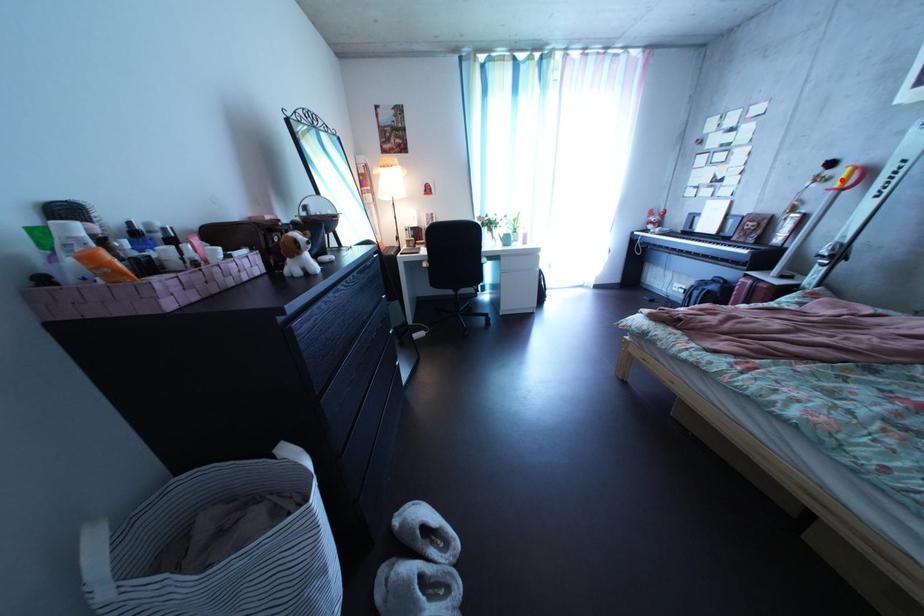
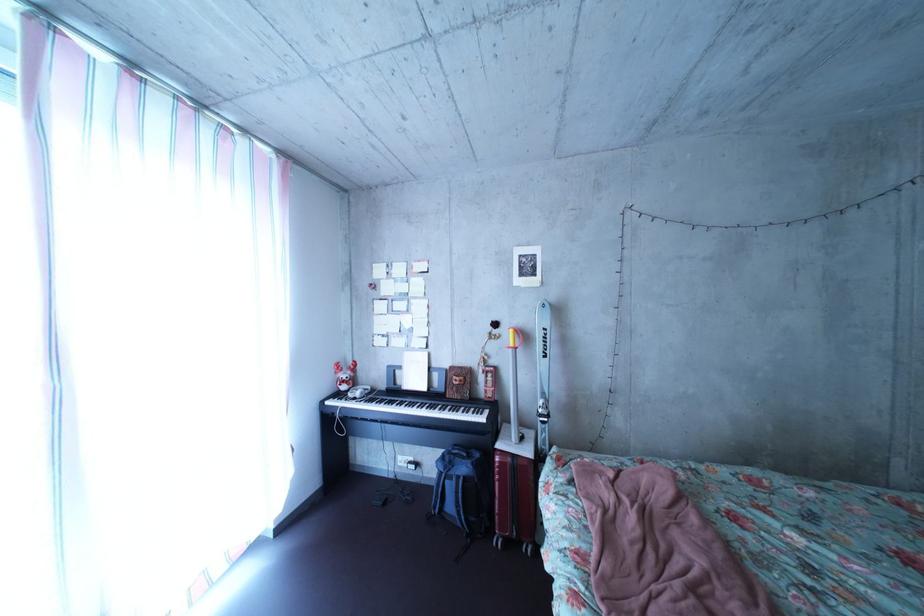
Question: I am providing you with two images of the same scene from different viewpoints. A red point is shown in image1. For the corresponding object point in image2, is it positioned nearer or farther from the camera?

Choices:
 (A) Nearer
 (B) Farther

Answer: (A)